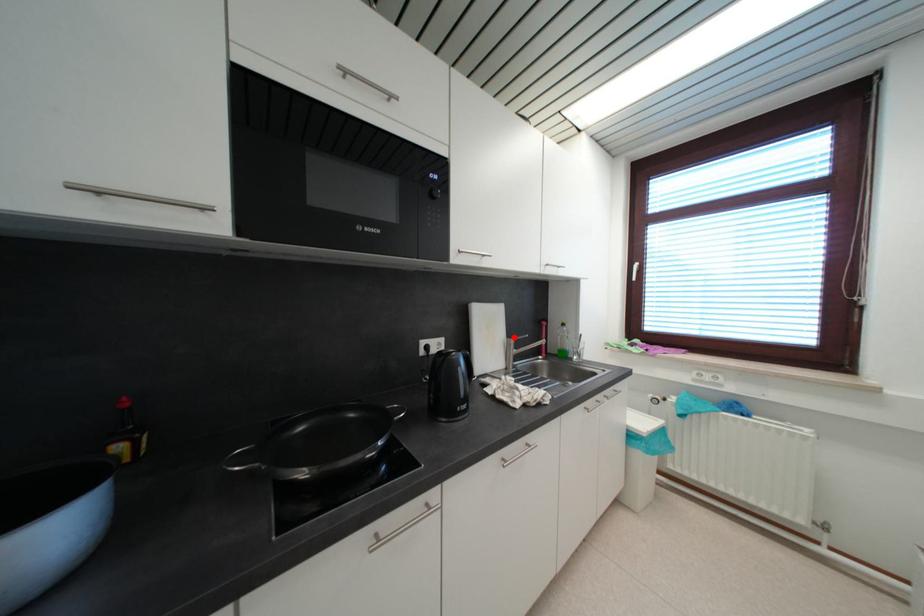
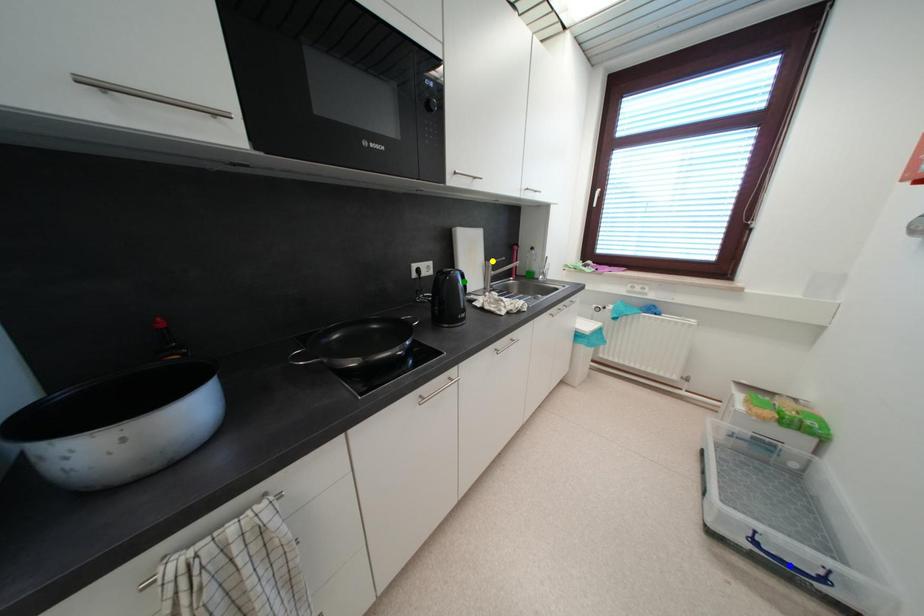
Question: I am providing you with two images of the same scene from different viewpoints. A red point is marked on the first image. You are given multiple points on the second image. Which point in image 2 is actually the same real-world point as the red point in image 1?

Choices:
 (A) yellow point
 (B) green point
 (C) blue point

Answer: (A)